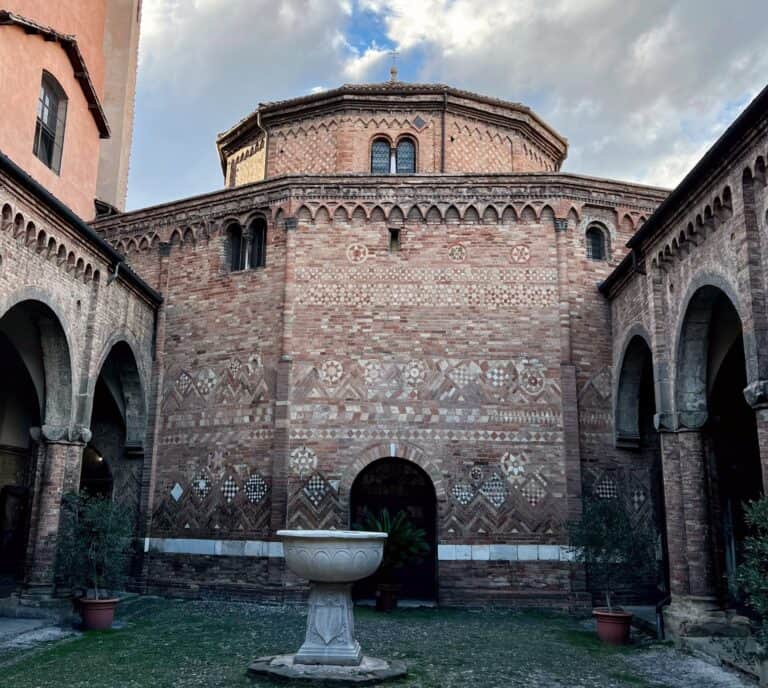
The height and width of the screenshot is (688, 768). Find the location of `brown plant pot left side`. brown plant pot left side is located at coordinates (91, 616).